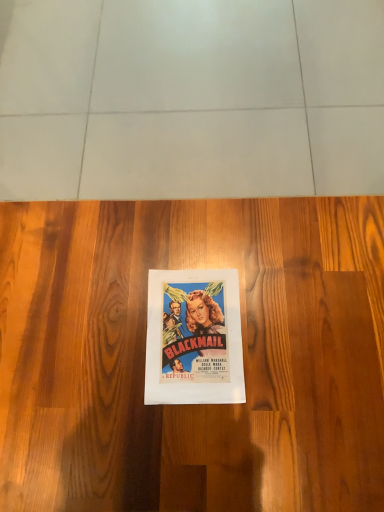
The image size is (384, 512). Find the location of `vacant space behind matte paper poster at center`. vacant space behind matte paper poster at center is located at coordinates (184, 234).